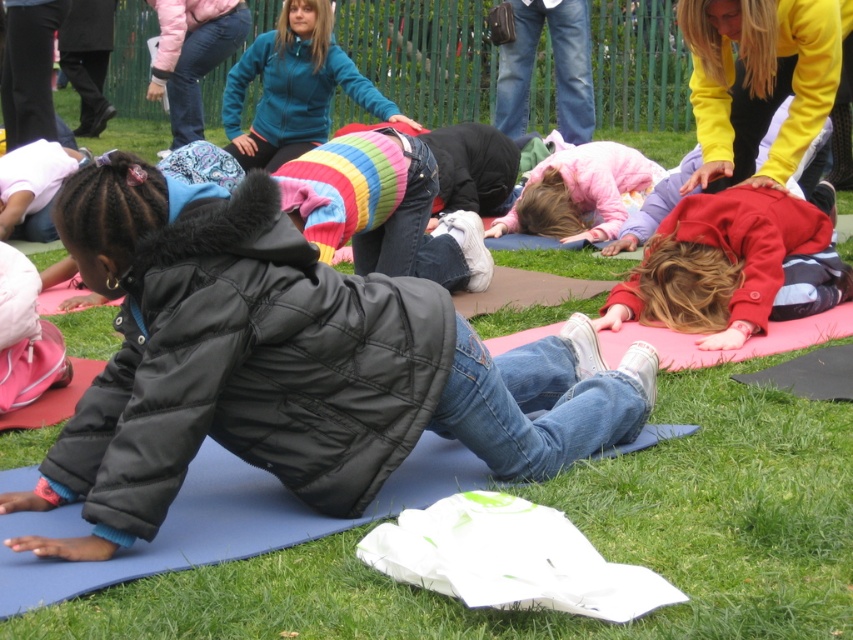
Is point (592, 173) positioned behind point (3, 336)?

Yes, point (592, 173) is farther from viewer.

Which is behind, point (549, 195) or point (10, 300)?

The point (549, 195) is more distant.

Image resolution: width=853 pixels, height=640 pixels. Find the location of `pink fleece jacket at center`. pink fleece jacket at center is located at coordinates (579, 193).

Where is `pink fleece jacket at center`? This screenshot has width=853, height=640. pink fleece jacket at center is located at coordinates (579, 193).

Can you confirm if black quilted jacket at center is positioned above striped sweater at center?

Actually, black quilted jacket at center is below striped sweater at center.

Does point (274, 250) come farther from viewer compared to point (314, 125)?

No.

The height and width of the screenshot is (640, 853). In order to click on black quilted jacket at center in this screenshot , I will do `click(288, 365)`.

Identify the location of black quilted jacket at center. (288, 365).

Between point (699, 228) and point (248, 51), which one is positioned behind?

Positioned behind is point (248, 51).

Is red matte jacket at lower right smaller than striped sweater at center?

Correct, red matte jacket at lower right occupies less space than striped sweater at center.

Describe the element at coordinates (718, 264) in the screenshot. The width and height of the screenshot is (853, 640). I see `red matte jacket at lower right` at that location.

Find the location of `red matte jacket at lower right`. red matte jacket at lower right is located at coordinates (718, 264).